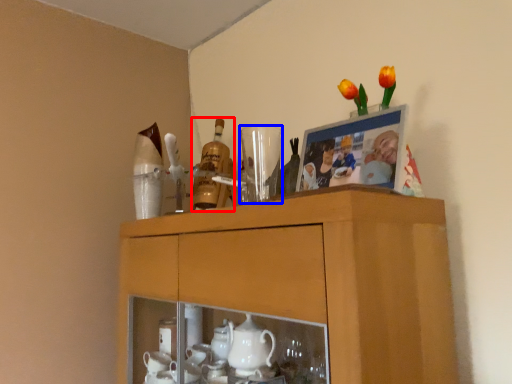
Question: Which object appears closest to the camera in this image, bottle (highlighted by a red box) or tableware (highlighted by a blue box)?

Choices:
 (A) bottle
 (B) tableware

Answer: (B)